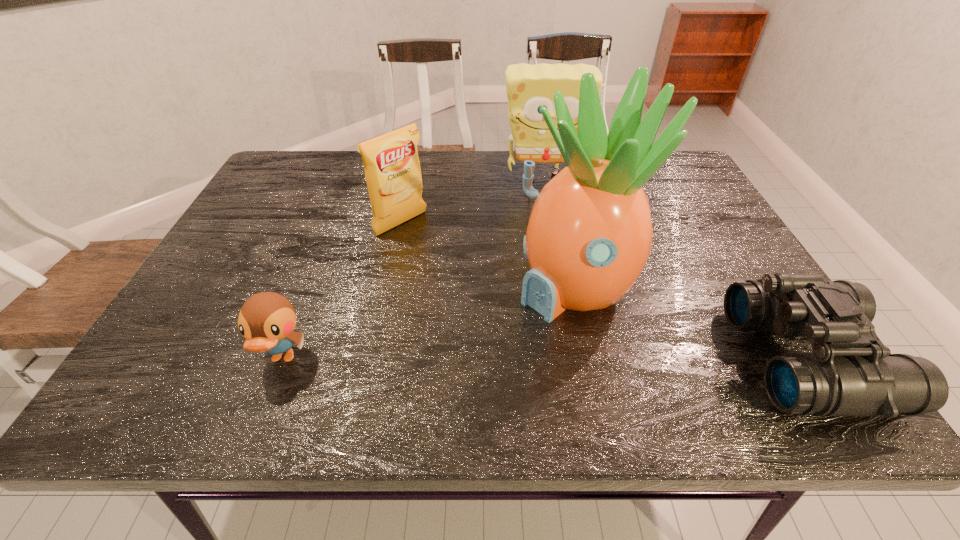
At what (x,y) coordinates should I click in order to perform the action: click on vacant spot on the desktop that is between the duck and the rightmost object and is positioned on the front of the second object from left to right with the logo. Please return your answer as a coordinate pair (x, y). Looking at the image, I should click on (578, 359).

Find the location of a particular element. This screenshot has height=540, width=960. vacant spot on the desktop that is between the duck and the rightmost object and is positioned at the entrance of the pineapple is located at coordinates (487, 359).

Where is `free space on the desktop that is between the leftmost object and the rightmost object and is positioned on the face of the fourth shortest object`? free space on the desktop that is between the leftmost object and the rightmost object and is positioned on the face of the fourth shortest object is located at coordinates (568, 359).